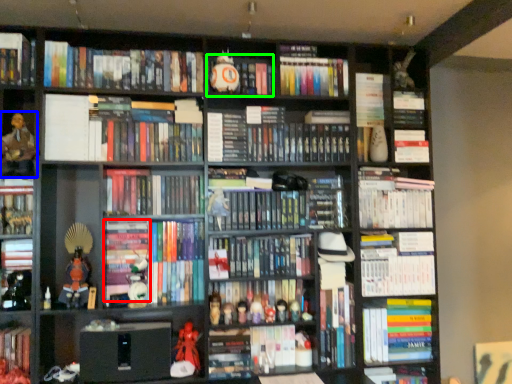
Question: Based on their relative distances, which object is nearer to book (highlighted by a red box)? Choose from person (highlighted by a blue box) and book (highlighted by a green box).

Choices:
 (A) person
 (B) book

Answer: (A)